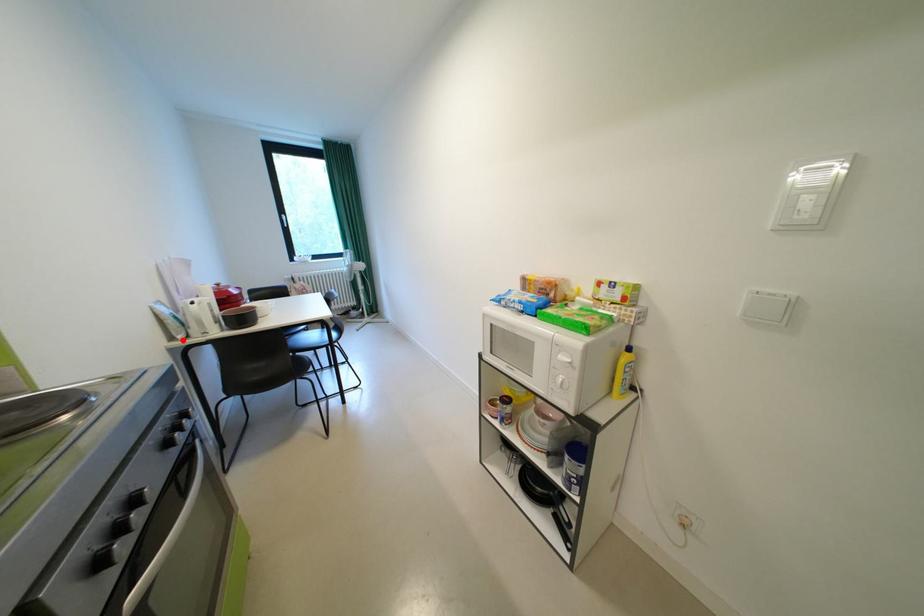
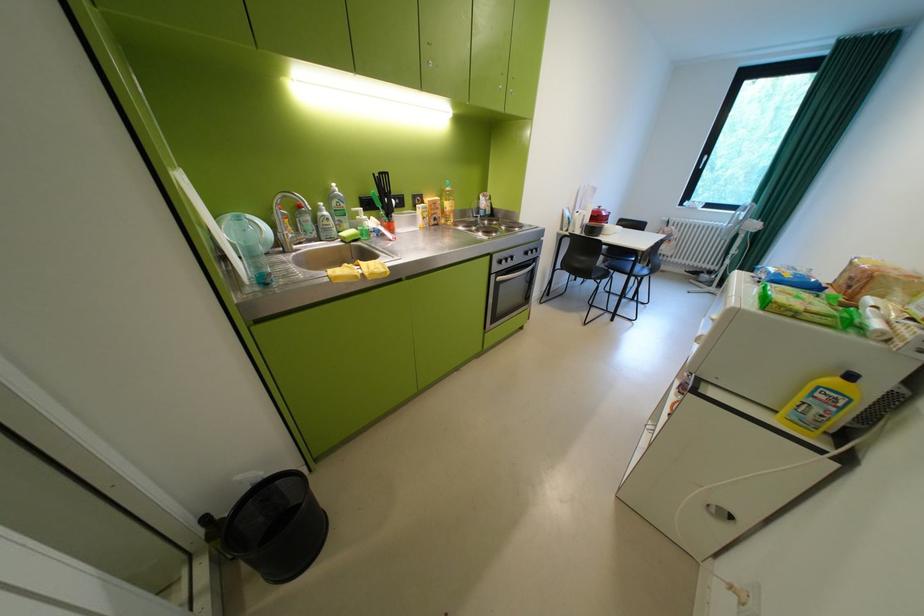
Question: I am providing you with two images of the same scene from different viewpoints. A red point is marked on the first image. Is the red point's position out of view in image 2?

Choices:
 (A) Yes
 (B) No

Answer: (B)